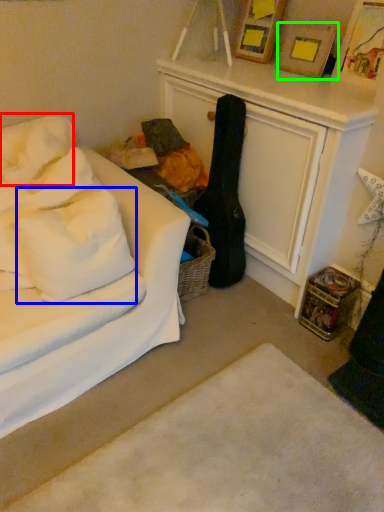
Question: Based on their relative distances, which object is nearer to pillow (highlighted by a red box)? Choose from pillow (highlighted by a blue box) and picture frame (highlighted by a green box).

Choices:
 (A) pillow
 (B) picture frame

Answer: (A)